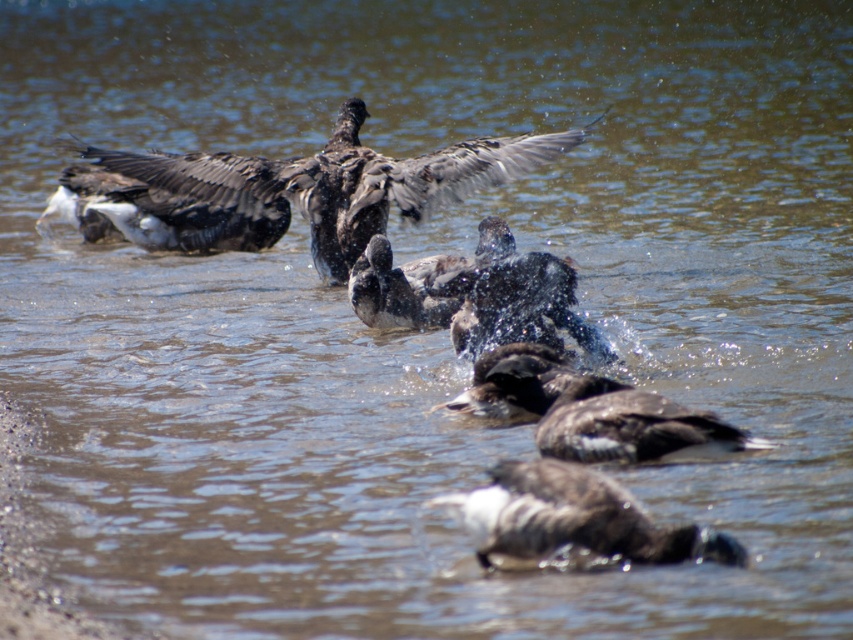
Between dark brown feathers at center and dark brown feathers at lower center, which one is positioned higher?

Positioned higher is dark brown feathers at center.

Which of these two, dark brown feathers at center or dark brown feathers at lower center, stands shorter?

dark brown feathers at lower center

Describe the element at coordinates (593, 410) in the screenshot. The width and height of the screenshot is (853, 640). I see `dark brown feathers at center` at that location.

Image resolution: width=853 pixels, height=640 pixels. What are the coordinates of `dark brown feathers at center` in the screenshot? It's located at (593, 410).

Is dark gray feathers at center smaller than dark brown feathers at lower center?

Incorrect, dark gray feathers at center is not smaller in size than dark brown feathers at lower center.

Is point (581, 129) positioned behind point (677, 554)?

Yes, it is.

Where is `dark gray feathers at center`? The width and height of the screenshot is (853, 640). dark gray feathers at center is located at coordinates (317, 186).

Does point (292, 173) come closer to viewer compared to point (490, 364)?

No.

Which of these two, dark gray feathers at center or dark brown feathers at center, stands taller?

Standing taller between the two is dark gray feathers at center.

Where is `dark gray feathers at center`? The height and width of the screenshot is (640, 853). dark gray feathers at center is located at coordinates (317, 186).